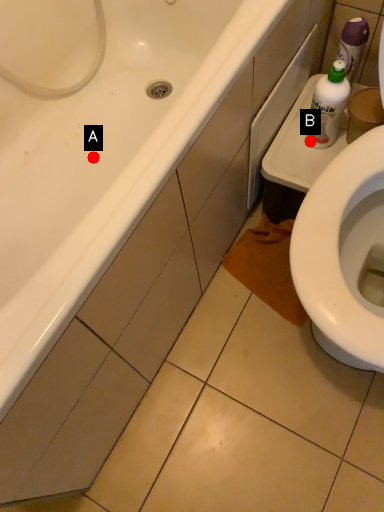
Question: Two points are circled on the image, labeled by A and B beside each circle. Which point is closer to the camera?

Choices:
 (A) A is closer
 (B) B is closer

Answer: (B)